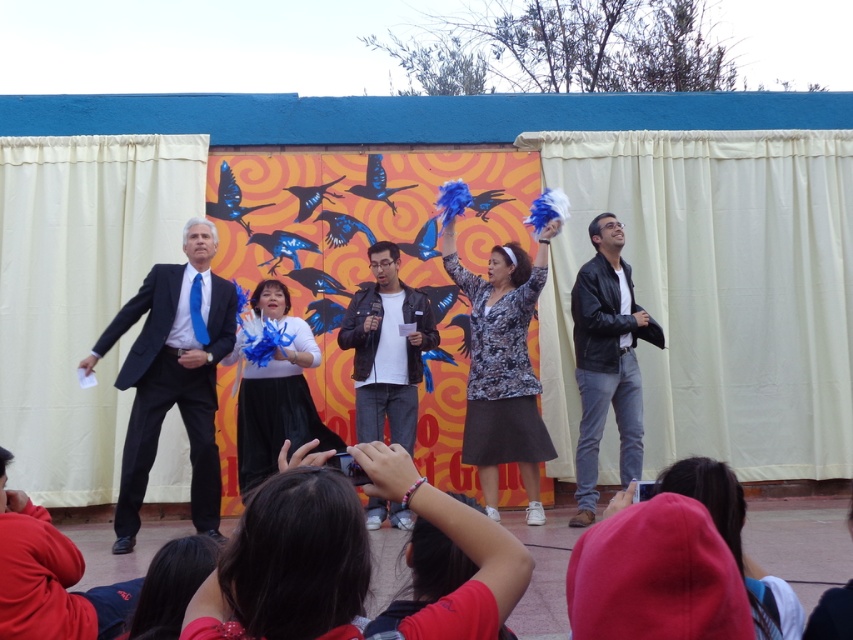
You are an event photographer trying to capture a group photo of the performers. You notice the matte red shirt at lower center and the leather jacket at center. Which performer should you position slightly to the left to align them properly for the photo?

The matte red shirt at lower center is to the right of the leather jacket at center. To align them properly, you should position the matte red shirt at lower center slightly to the left so that it moves closer to the leather jacket at center.

You are a stagehand standing at the back of the stage. You need to hand a microphone to the performer in the matte black suit at left and then to the performer in the matte red shirt at lower center. Given that you can move freely but want to minimize the distance you walk, which performer should you approach first?

You should first approach the performer in the matte red shirt at lower center because they are closer to your starting position at the back of the stage. After handing them the microphone, you can then move the shorter distance of 4.48 meters to reach the matte black suit at left.